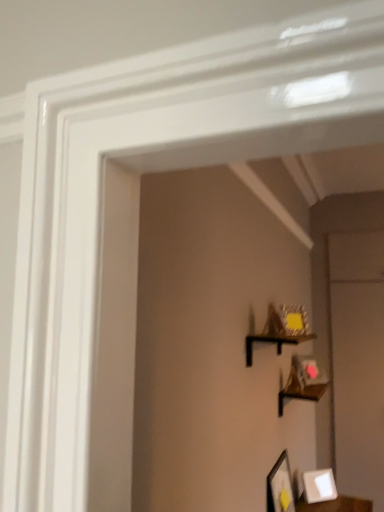
Identify the location of matte black picture frame at lower right, arranged as the second picture frame when viewed from the right. This screenshot has height=512, width=384. (280, 486).

Describe the element at coordinates (280, 486) in the screenshot. I see `matte black picture frame at lower right, the 1th picture frame in the left-to-right sequence` at that location.

Locate an element on the screen. This screenshot has width=384, height=512. black matte shelf at upper center is located at coordinates (273, 343).

Can you confirm if black matte shelf at upper center is wider than white matte picture frame at lower right, which ranks as the second picture frame in left-to-right order?

Yes.

Which picture frame is the 2nd one when counting from the back of the black matte shelf at upper center? Please provide its 2D coordinates.

[(319, 486)]

Considering the points (268, 335) and (323, 500), which point is in front, point (268, 335) or point (323, 500)?

Point (268, 335)

Is black matte shelf at upper center positioned far away from white matte picture frame at lower right, the 2th picture frame when ordered from front to back?

→ That's not correct — black matte shelf at upper center is a little close to white matte picture frame at lower right, the 2th picture frame when ordered from front to back.

Is there a large distance between matte black picture frame at lower right, arranged as the second picture frame when viewed from the right, and black matte shelf at upper center?

That's not correct — matte black picture frame at lower right, arranged as the second picture frame when viewed from the right, is a little close to black matte shelf at upper center.

Between matte black picture frame at lower right, positioned as the second picture frame in back-to-front order, and black matte shelf at upper center, which one has more height?

Standing taller between the two is matte black picture frame at lower right, positioned as the second picture frame in back-to-front order.

From the picture: From a real-world perspective, is matte black picture frame at lower right, arranged as the second picture frame when viewed from the right, physically below black matte shelf at upper center?

Yes, from a real-world perspective, matte black picture frame at lower right, arranged as the second picture frame when viewed from the right, is beneath black matte shelf at upper center.

Looking at this image, is white matte picture frame at lower right, acting as the 1th picture frame starting from the back, thinner than black matte shelf at upper center?

Correct, the width of white matte picture frame at lower right, acting as the 1th picture frame starting from the back, is less than that of black matte shelf at upper center.

This screenshot has width=384, height=512. Find the location of `shelf above the white matte picture frame at lower right, which ranks as the second picture frame in left-to-right order (from a real-world perspective)`. shelf above the white matte picture frame at lower right, which ranks as the second picture frame in left-to-right order (from a real-world perspective) is located at coordinates (273, 343).

Is white matte picture frame at lower right, the 2th picture frame when ordered from front to back, closer to the viewer compared to black matte shelf at upper center?

That is False.

Is white matte picture frame at lower right, acting as the 1th picture frame starting from the back, oriented towards black matte shelf at upper center?

No, white matte picture frame at lower right, acting as the 1th picture frame starting from the back, is not aimed at black matte shelf at upper center.

Would you say matte black picture frame at lower right, arranged as the second picture frame when viewed from the right, is a long distance from white matte picture frame at lower right, arranged as the first picture frame when viewed from the right?

matte black picture frame at lower right, arranged as the second picture frame when viewed from the right, is near white matte picture frame at lower right, arranged as the first picture frame when viewed from the right, not far away.

Is matte black picture frame at lower right, arranged as the second picture frame when viewed from the right, facing towards white matte picture frame at lower right, which ranks as the second picture frame in left-to-right order?

No, matte black picture frame at lower right, arranged as the second picture frame when viewed from the right, is not facing towards white matte picture frame at lower right, which ranks as the second picture frame in left-to-right order.

Which is more to the right, matte black picture frame at lower right, the 1th picture frame in the left-to-right sequence, or white matte picture frame at lower right, which ranks as the second picture frame in left-to-right order?

white matte picture frame at lower right, which ranks as the second picture frame in left-to-right order.

Which of these two, matte black picture frame at lower right, positioned as the second picture frame in back-to-front order, or white matte picture frame at lower right, acting as the 1th picture frame starting from the back, is thinner?

matte black picture frame at lower right, positioned as the second picture frame in back-to-front order, is thinner.

Is white matte picture frame at lower right, arranged as the first picture frame when viewed from the right, looking in the opposite direction of matte black picture frame at lower right, arranged as the second picture frame when viewed from the right?

No, white matte picture frame at lower right, arranged as the first picture frame when viewed from the right, is not facing the opposite direction of matte black picture frame at lower right, arranged as the second picture frame when viewed from the right.

Which of these two, white matte picture frame at lower right, acting as the 1th picture frame starting from the back, or matte black picture frame at lower right, the 1th picture frame in the front-to-back sequence, is bigger?

Bigger between the two is matte black picture frame at lower right, the 1th picture frame in the front-to-back sequence.

Considering the sizes of objects white matte picture frame at lower right, arranged as the first picture frame when viewed from the right, and matte black picture frame at lower right, arranged as the second picture frame when viewed from the right, in the image provided, who is thinner, white matte picture frame at lower right, arranged as the first picture frame when viewed from the right, or matte black picture frame at lower right, arranged as the second picture frame when viewed from the right,?

matte black picture frame at lower right, arranged as the second picture frame when viewed from the right.

Is white matte picture frame at lower right, the 2th picture frame when ordered from front to back, spatially inside matte black picture frame at lower right, arranged as the second picture frame when viewed from the right, or outside of it?

white matte picture frame at lower right, the 2th picture frame when ordered from front to back, is outside matte black picture frame at lower right, arranged as the second picture frame when viewed from the right.

Which object is further away from the camera taking this photo, black matte shelf at upper center or matte black picture frame at lower right, the 1th picture frame in the front-to-back sequence?

Positioned behind is matte black picture frame at lower right, the 1th picture frame in the front-to-back sequence.

Between black matte shelf at upper center and matte black picture frame at lower right, arranged as the second picture frame when viewed from the right, which one has larger width?

Wider between the two is black matte shelf at upper center.

This screenshot has width=384, height=512. I want to click on shelf above the matte black picture frame at lower right, the 1th picture frame in the left-to-right sequence (from the image's perspective), so click(273, 343).

Identify the location of shelf above the white matte picture frame at lower right, acting as the 1th picture frame starting from the back (from the image's perspective). Image resolution: width=384 pixels, height=512 pixels. (273, 343).

The height and width of the screenshot is (512, 384). I want to click on shelf that appears on the left of matte black picture frame at lower right, arranged as the second picture frame when viewed from the right, so click(x=273, y=343).

Which object lies further to the anchor point white matte picture frame at lower right, which ranks as the second picture frame in left-to-right order, matte black picture frame at lower right, the 1th picture frame in the left-to-right sequence, or black matte shelf at upper center?

Based on the image, black matte shelf at upper center appears to be further to white matte picture frame at lower right, which ranks as the second picture frame in left-to-right order.

Consider the image. From the image, which object appears to be nearer to white matte picture frame at lower right, which ranks as the second picture frame in left-to-right order, black matte shelf at upper center or matte black picture frame at lower right, the 1th picture frame in the left-to-right sequence?

matte black picture frame at lower right, the 1th picture frame in the left-to-right sequence, is positioned closer to the anchor white matte picture frame at lower right, which ranks as the second picture frame in left-to-right order.

Which object lies further to the anchor point matte black picture frame at lower right, positioned as the second picture frame in back-to-front order, white matte picture frame at lower right, which ranks as the second picture frame in left-to-right order, or black matte shelf at upper center?

Based on the image, black matte shelf at upper center appears to be further to matte black picture frame at lower right, positioned as the second picture frame in back-to-front order.

Looking at the image, which one is located closer to black matte shelf at upper center, matte black picture frame at lower right, arranged as the second picture frame when viewed from the right, or white matte picture frame at lower right, which ranks as the second picture frame in left-to-right order?

matte black picture frame at lower right, arranged as the second picture frame when viewed from the right, lies closer to black matte shelf at upper center than the other object.

Based on the photo, from the image, which object appears to be farther from matte black picture frame at lower right, the 1th picture frame in the front-to-back sequence, black matte shelf at upper center or white matte picture frame at lower right, the 2th picture frame when ordered from front to back?

black matte shelf at upper center is positioned further to the anchor matte black picture frame at lower right, the 1th picture frame in the front-to-back sequence.

Considering their positions, is white matte picture frame at lower right, the 2th picture frame when ordered from front to back, positioned further to black matte shelf at upper center than matte black picture frame at lower right, the 1th picture frame in the front-to-back sequence?

white matte picture frame at lower right, the 2th picture frame when ordered from front to back, is positioned further to the anchor black matte shelf at upper center.

Find the location of `picture frame between black matte shelf at upper center and white matte picture frame at lower right, acting as the 1th picture frame starting from the back, in the up-down direction`. picture frame between black matte shelf at upper center and white matte picture frame at lower right, acting as the 1th picture frame starting from the back, in the up-down direction is located at coordinates (280, 486).